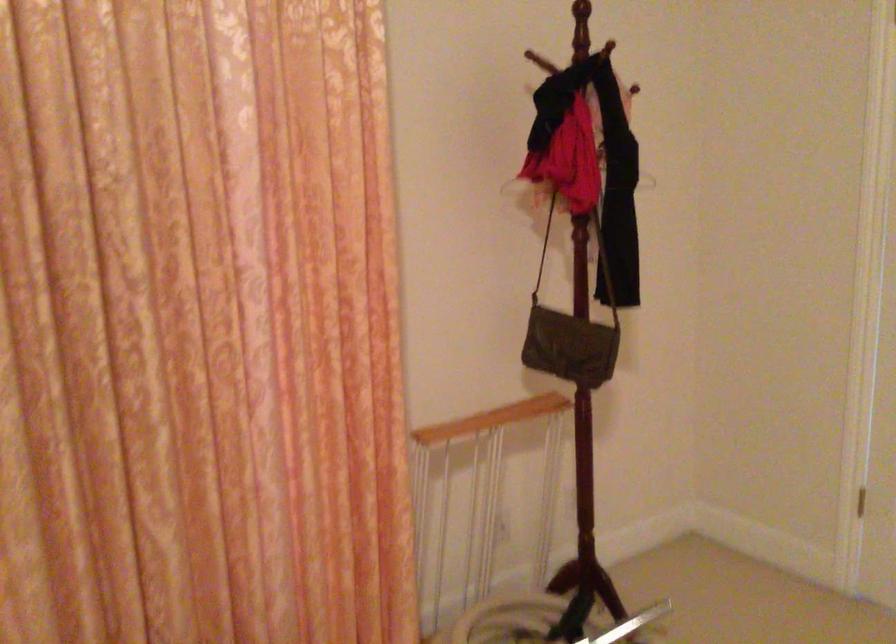
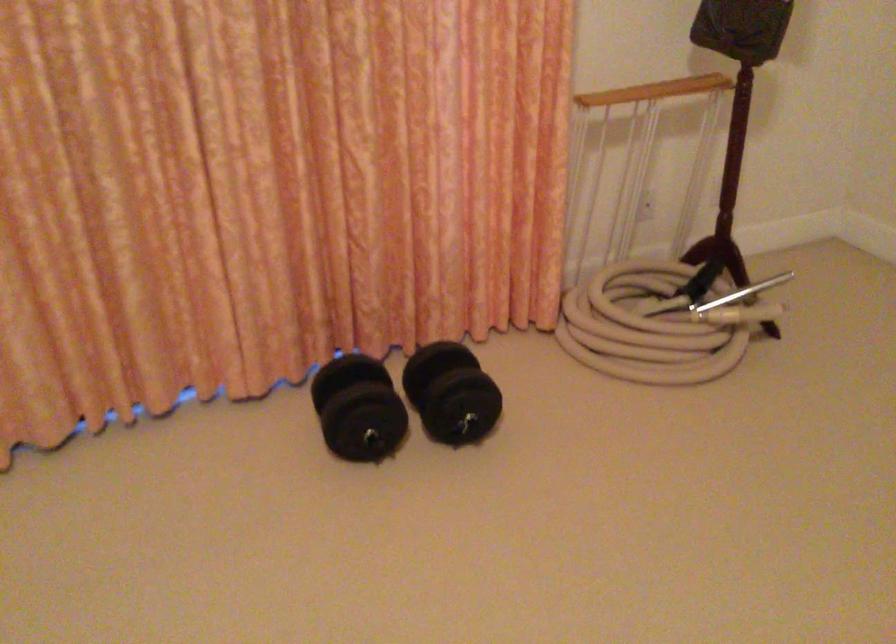
Locate, in the second image, the point that corresponds to the point at 558,451 in the first image.

(719, 137)